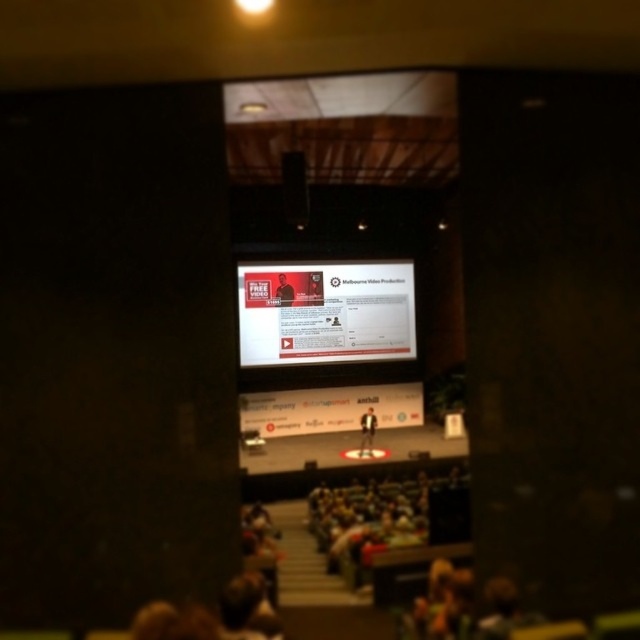
The image size is (640, 640). Find the location of `matte white screen at center`. matte white screen at center is located at coordinates (326, 312).

Can you confirm if matte white screen at center is positioned above matte black speaker at center?

No, matte white screen at center is not above matte black speaker at center.

What do you see at coordinates (326, 312) in the screenshot? This screenshot has height=640, width=640. I see `matte white screen at center` at bounding box center [326, 312].

Image resolution: width=640 pixels, height=640 pixels. Identify the location of matte white screen at center. coord(326,312).

In the scene shown: Can you confirm if matte white screen at center is positioned to the left of dark suit at center?

Yes, matte white screen at center is to the left of dark suit at center.

Is matte white screen at center below dark suit at center?

No, matte white screen at center is not below dark suit at center.

This screenshot has width=640, height=640. Describe the element at coordinates (326, 312) in the screenshot. I see `matte white screen at center` at that location.

The height and width of the screenshot is (640, 640). Identify the location of matte white screen at center. (326, 312).

How distant is matte black speaker at center from dark suit at center?

matte black speaker at center and dark suit at center are 2.36 meters apart.

Who is higher up, matte black speaker at center or dark suit at center?

matte black speaker at center is above.

Where is `matte black speaker at center`? matte black speaker at center is located at coordinates (294, 188).